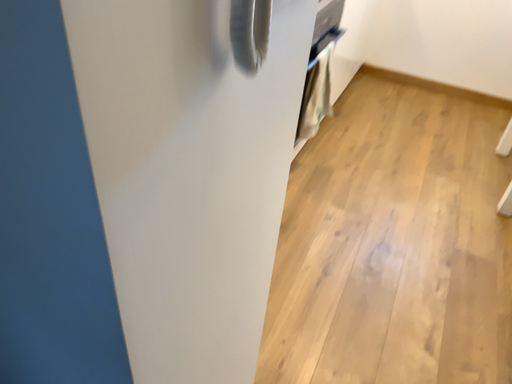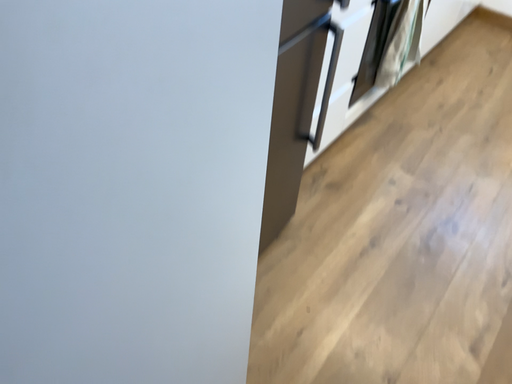
Question: How did the camera likely rotate when shooting the video?

Choices:
 (A) rotated right
 (B) rotated left

Answer: (B)